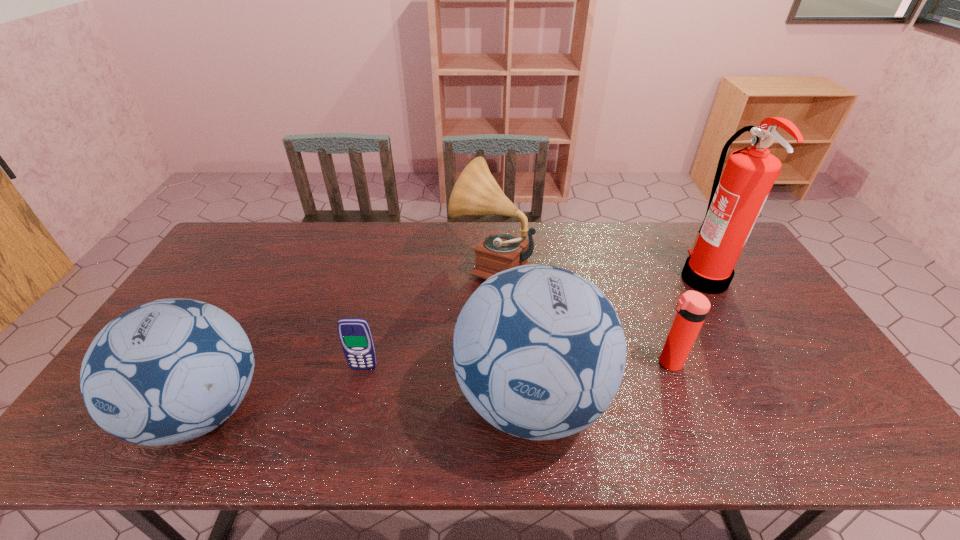
In order to click on object at the left edge in this screenshot , I will do `click(171, 370)`.

Identify the location of object that is at the right edge. Image resolution: width=960 pixels, height=540 pixels. (735, 203).

The height and width of the screenshot is (540, 960). I want to click on object that is at the near left corner, so click(171, 370).

Identify the location of object at the far right corner. (735, 203).

Locate an element on the screen. This screenshot has height=540, width=960. free space at the far edge of the desktop is located at coordinates (315, 261).

The height and width of the screenshot is (540, 960). Identify the location of vacant space at the right edge. (741, 271).

The width and height of the screenshot is (960, 540). Find the location of `unoccupied position between the right soccer ball and the fourth tallest object`. unoccupied position between the right soccer ball and the fourth tallest object is located at coordinates tap(367, 405).

Identify the location of free point between the right soccer ball and the shortest object. The height and width of the screenshot is (540, 960). (447, 384).

You are a GUI agent. You are given a task and a screenshot of the screen. Output one action in this format:
    pyautogui.click(x=<x>, y=<y>)
    Task: Click on the object that is the third closest to the phonograph record
    
    Given the screenshot: What is the action you would take?
    pyautogui.click(x=692, y=308)

Where is `object that ranks as the closest to the leftmost object`? The image size is (960, 540). object that ranks as the closest to the leftmost object is located at coordinates point(355,335).